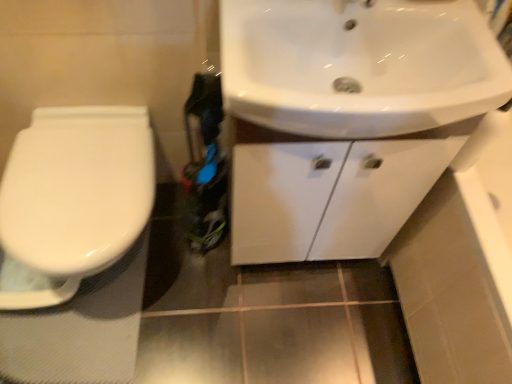
At what (x,y) coordinates should I click in order to perform the action: click on vacant area on top of white glossy toilet at left (from a real-world perspective). Please return your answer as a coordinate pair (x, y). The height and width of the screenshot is (384, 512). Looking at the image, I should click on (68, 187).